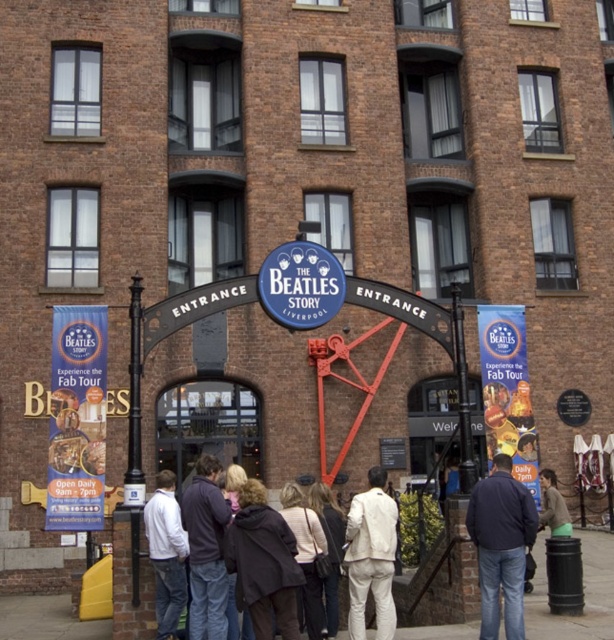
Question: Estimate the real-world distances between objects in this image. Which object is closer to the blue fabric banner at entrance?

Choices:
 (A) dark blue jeans at center
 (B) white matte jacket at lower left

Answer: (B)

Question: Does dark blue jacket at center lie behind white matte jacket at lower left?

Choices:
 (A) no
 (B) yes

Answer: (A)

Question: Which of the following is the farthest from the observer?

Choices:
 (A) (158, 508)
 (B) (381, 541)
 (C) (286, 600)
 (D) (317, 257)

Answer: (D)

Question: Does white cotton jacket at center have a smaller size compared to dark brown leather jacket at center?

Choices:
 (A) yes
 (B) no

Answer: (B)

Question: Is white cotton jacket at center positioned behind blue matte sign at center?

Choices:
 (A) no
 (B) yes

Answer: (A)

Question: Which object is positioned closest to the blue fabric banner at entrance?

Choices:
 (A) white matte jacket at center
 (B) blue matte sign at center
 (C) dark brown leather jacket at center

Answer: (B)